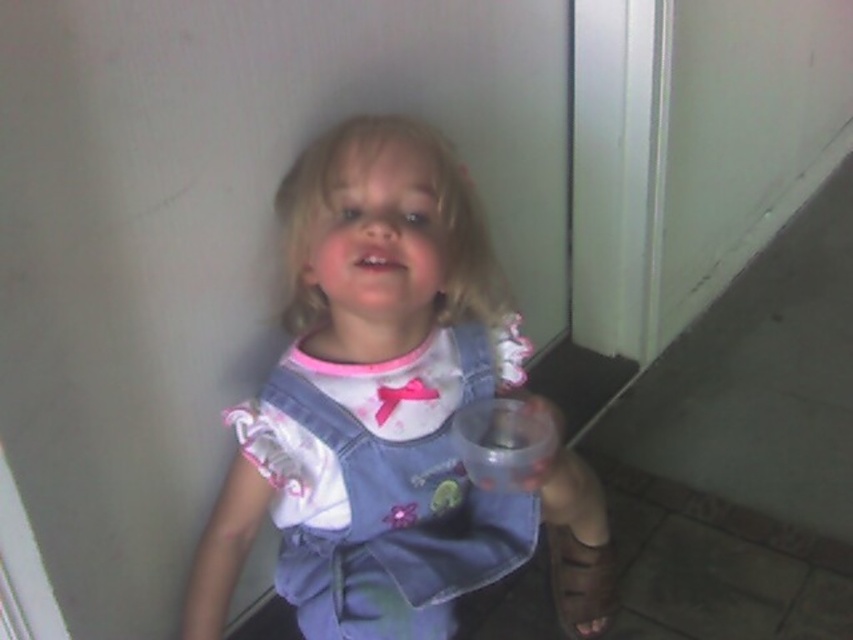
From the picture: Which is above, denim overalls at center or denim dress at center?

denim overalls at center

This screenshot has height=640, width=853. Describe the element at coordinates (389, 410) in the screenshot. I see `denim overalls at center` at that location.

Between point (399, 468) and point (476, 547), which one is positioned in front?

Point (399, 468) is more forward.

Find the location of a particular element. Image resolution: width=853 pixels, height=640 pixels. denim overalls at center is located at coordinates (389, 410).